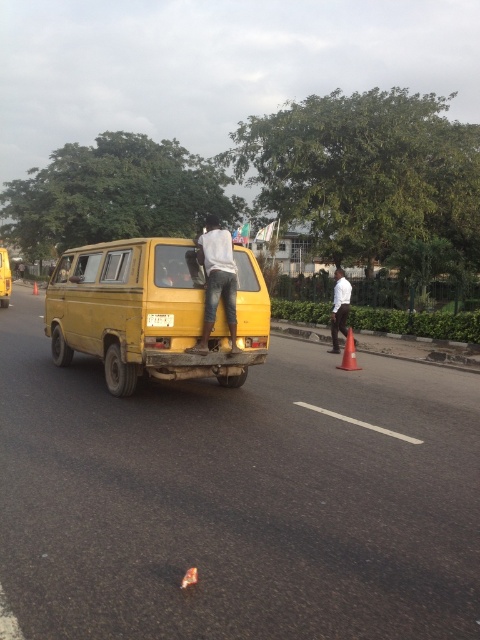
You are a pedestrian standing on the sidewalk and see the yellow matte taxi at center and the orange matte traffic cone at right. Which object is closer to you?

The yellow matte taxi at center is closer to you because it is positioned further to the viewer than the orange matte traffic cone at right.

You are a delivery person who needs to place a package on the yellow matte taxi at center. The package must be placed exactly at the point marked by coordinates point (4, 278). Can you confirm the location of this point on the yellow matte taxi at center?

The point (4, 278) marks the yellow matte taxi at center, so the package should be placed there.

You are a delivery driver who needs to park your truck between the two orange matte traffic cones. The orange matte traffic cone at right and the orange matte traffic cone at center are both orange and matte. Which traffic cone is narrower so you can safely park your truck without hitting it?

The orange matte traffic cone at right is narrower than the orange matte traffic cone at center, so you should park closer to the orange matte traffic cone at right to avoid hitting the wider one.